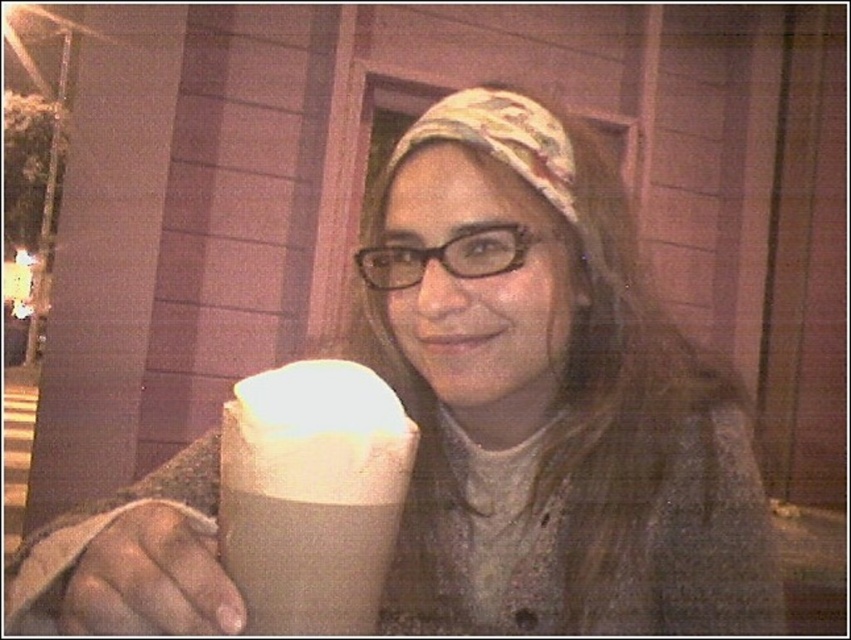
Between smooth beige hand at lower left and patterned fabric headscarf at center, which one is positioned higher?

patterned fabric headscarf at center is higher up.

In the scene shown: Can you confirm if smooth beige hand at lower left is smaller than patterned fabric headscarf at center?

Yes.

Which is behind, point (163, 593) or point (513, 141)?

The point (513, 141) is behind.

Where is `smooth beige hand at lower left`? The width and height of the screenshot is (851, 640). smooth beige hand at lower left is located at coordinates (151, 579).

Who is positioned more to the left, white paper cup at center or patterned fabric headscarf at center?

white paper cup at center is more to the left.

Between point (283, 513) and point (518, 156), which one is positioned behind?

The point (518, 156) is more distant.

Image resolution: width=851 pixels, height=640 pixels. Find the location of `white paper cup at center`. white paper cup at center is located at coordinates (312, 493).

Which is more to the left, white paper cup at center or smooth beige hand at lower left?

smooth beige hand at lower left

Can you confirm if white paper cup at center is smaller than smooth beige hand at lower left?

No.

Which is behind, point (266, 445) or point (112, 605)?

Point (112, 605)

Image resolution: width=851 pixels, height=640 pixels. I want to click on white paper cup at center, so click(312, 493).